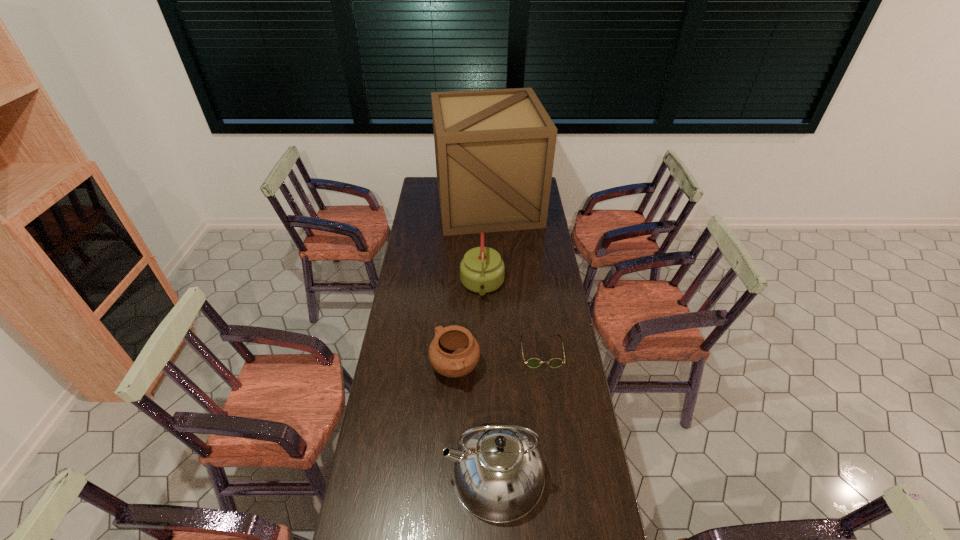
Image resolution: width=960 pixels, height=540 pixels. Find the location of `free spot between the second shortest object and the shortest object`. free spot between the second shortest object and the shortest object is located at coordinates (498, 360).

Identify which object is the nearest to the farther kettle. Please provide its 2D coordinates. Your answer should be formatted as a tuple, i.e. [(x, y)], where the tuple contains the x and y coordinates of a point satisfying the conditions above.

[(533, 362)]

Where is `object that is the fourth closest to the nearest object`? The height and width of the screenshot is (540, 960). object that is the fourth closest to the nearest object is located at coordinates (494, 149).